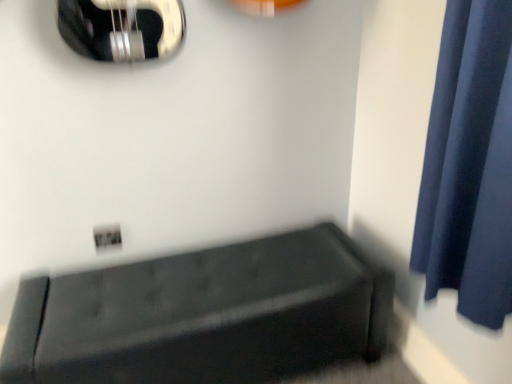
Question: From the image's perspective, does dark blue fabric curtain at right appear lower than velvet black bench at lower right?

Choices:
 (A) yes
 (B) no

Answer: (B)

Question: Are dark blue fabric curtain at right and velvet black bench at lower right far apart?

Choices:
 (A) no
 (B) yes

Answer: (A)

Question: Can you confirm if dark blue fabric curtain at right is positioned to the left of velvet black bench at lower right?

Choices:
 (A) yes
 (B) no

Answer: (B)

Question: From a real-world perspective, does dark blue fabric curtain at right stand above velvet black bench at lower right?

Choices:
 (A) yes
 (B) no

Answer: (A)

Question: Does dark blue fabric curtain at right come behind velvet black bench at lower right?

Choices:
 (A) yes
 (B) no

Answer: (B)

Question: Is dark blue fabric curtain at right facing towards velvet black bench at lower right?

Choices:
 (A) no
 (B) yes

Answer: (A)

Question: From a real-world perspective, is velvet black bench at lower right located higher than dark blue fabric curtain at right?

Choices:
 (A) no
 (B) yes

Answer: (A)

Question: Could you tell me if velvet black bench at lower right is turned towards dark blue fabric curtain at right?

Choices:
 (A) no
 (B) yes

Answer: (A)

Question: Does velvet black bench at lower right have a lesser height compared to dark blue fabric curtain at right?

Choices:
 (A) yes
 (B) no

Answer: (A)

Question: Does velvet black bench at lower right come in front of dark blue fabric curtain at right?

Choices:
 (A) yes
 (B) no

Answer: (B)

Question: Is velvet black bench at lower right positioned far away from dark blue fabric curtain at right?

Choices:
 (A) yes
 (B) no

Answer: (B)

Question: Are velvet black bench at lower right and dark blue fabric curtain at right making contact?

Choices:
 (A) yes
 (B) no

Answer: (B)

Question: From a real-world perspective, is velvet black bench at lower right above or below dark blue fabric curtain at right?

Choices:
 (A) below
 (B) above

Answer: (A)